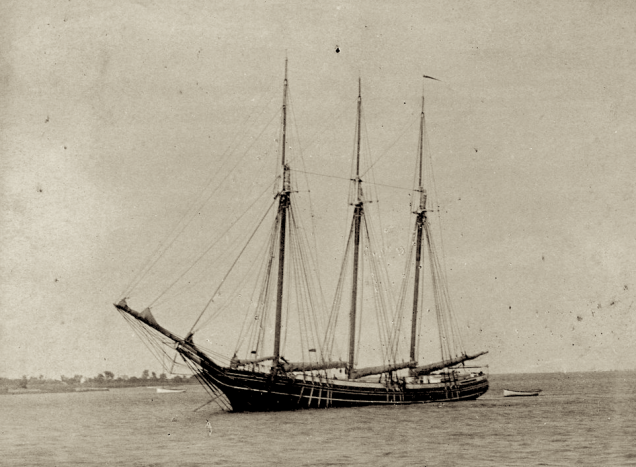
I want to click on cords, so click(387, 288), click(338, 286), click(317, 280), click(301, 279).